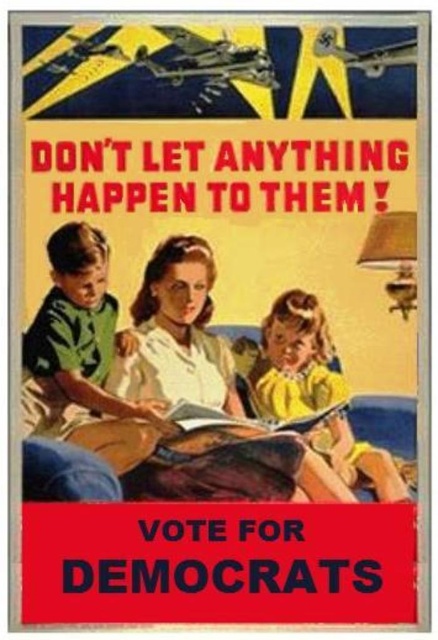
Does point (282, 419) come behind point (338, 406)?

That is True.

Is yellow matte dress at lower right above hardcover book at center?

Yes, yellow matte dress at lower right is above hardcover book at center.

Which is in front, point (317, 392) or point (283, 422)?

Positioned in front is point (283, 422).

At what (x,y) coordinates should I click in order to perform the action: click on yellow matte dress at lower right. Please return your answer as a coordinate pair (x, y). The width and height of the screenshot is (438, 640). Looking at the image, I should click on (295, 360).

Which of these two, green matte shirt at left or yellow matte dress at lower right, stands taller?

green matte shirt at left

Who is positioned more to the right, green matte shirt at left or yellow matte dress at lower right?

yellow matte dress at lower right is more to the right.

You are a GUI agent. You are given a task and a screenshot of the screen. Output one action in this format:
    pyautogui.click(x=<x>, y=<y>)
    Task: Click on the green matte shirt at left
    This screenshot has height=640, width=438.
    Given the screenshot: What is the action you would take?
    pyautogui.click(x=76, y=339)

The width and height of the screenshot is (438, 640). I want to click on green matte shirt at left, so click(x=76, y=339).

Does green matte shirt at left appear on the right side of hardcover book at center?

In fact, green matte shirt at left is to the left of hardcover book at center.

Where is `green matte shirt at left`? green matte shirt at left is located at coordinates (76, 339).

This screenshot has height=640, width=438. Identify the location of green matte shirt at left. (76, 339).